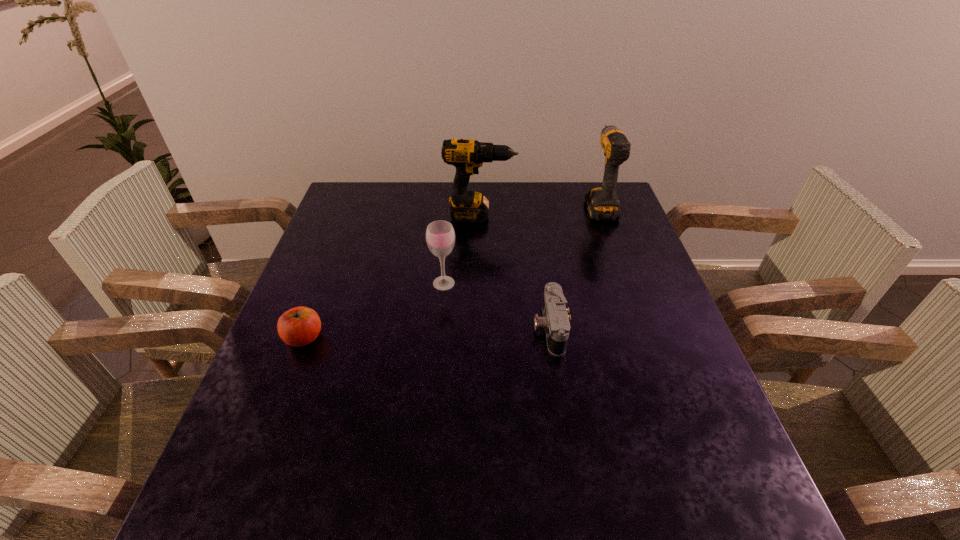
Locate an element on the screen. Image resolution: width=960 pixels, height=540 pixels. the right drill is located at coordinates (602, 203).

You are a GUI agent. You are given a task and a screenshot of the screen. Output one action in this format:
    pyautogui.click(x=<x>, y=<y>)
    Task: Click on the left drill
    Image resolution: width=960 pixels, height=540 pixels.
    Given the screenshot: What is the action you would take?
    pyautogui.click(x=467, y=155)

This screenshot has width=960, height=540. Find the location of `the third shortest object`. the third shortest object is located at coordinates (440, 236).

The image size is (960, 540). In order to click on wineglass in this screenshot , I will do [440, 236].

Identify the location of apple. (299, 326).

Find the location of a particular element. the second object from right to left is located at coordinates (555, 321).

Find the location of a particular element. The image size is (960, 540). free region located 0.320m at the tip of the left drill is located at coordinates (617, 216).

Locate an element on the screen. Image resolution: width=960 pixels, height=540 pixels. vacant region located on the front of the wineglass is located at coordinates 434,391.

Locate an element on the screen. free space located 0.120m on the front of the apple is located at coordinates (280, 401).

Identify the location of vacant space positioned on the lens of the second object from right to left. (431, 328).